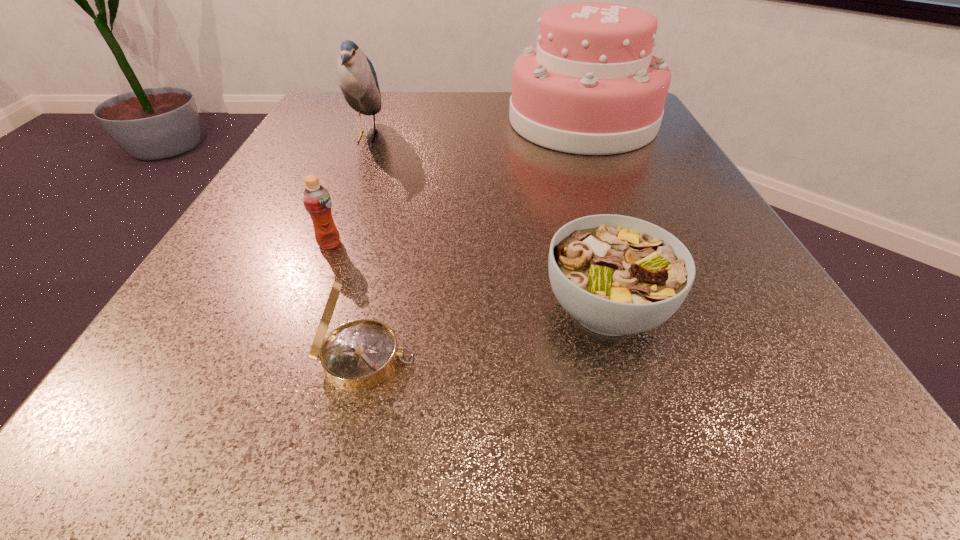
I want to click on birthday cake that is at the far edge, so click(x=591, y=86).

Identify the location of bird that is at the far edge. This screenshot has height=540, width=960. [358, 82].

Find the location of a particular element. The image size is (960, 540). object that is at the near edge is located at coordinates (358, 355).

This screenshot has height=540, width=960. I want to click on bird at the left edge, so click(358, 82).

I want to click on orange juice present at the left edge, so click(x=317, y=201).

Locate an element on the screen. birthday cake situated at the right edge is located at coordinates (591, 86).

Where is `soup bowl situated at the right edge`? The width and height of the screenshot is (960, 540). soup bowl situated at the right edge is located at coordinates (616, 275).

At what (x,y) coordinates should I click in order to perform the action: click on object located at the far left corner. Please return your answer as a coordinate pair (x, y). Looking at the image, I should click on (358, 82).

You are a GUI agent. You are given a task and a screenshot of the screen. Output one action in this format:
    pyautogui.click(x=<x>, y=<y>)
    Task: Click on the object that is at the far right corner
    The image size is (960, 540).
    Given the screenshot: What is the action you would take?
    pyautogui.click(x=591, y=86)

Find the location of a particular element. The image size is (960, 540). vacant space at the far edge of the desktop is located at coordinates (504, 113).